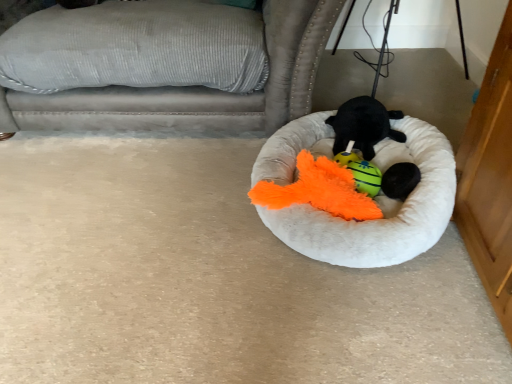
Question: From a real-world perspective, does black fuzzy ball at center stand above gray corduroy couch at upper left?

Choices:
 (A) no
 (B) yes

Answer: (A)

Question: Can you confirm if black fuzzy ball at center is smaller than gray corduroy couch at upper left?

Choices:
 (A) no
 (B) yes

Answer: (B)

Question: Is black fuzzy ball at center not close to gray corduroy couch at upper left?

Choices:
 (A) no
 (B) yes

Answer: (A)

Question: From the image's perspective, is black fuzzy ball at center located above gray corduroy couch at upper left?

Choices:
 (A) yes
 (B) no

Answer: (B)

Question: From the image's perspective, is black fuzzy ball at center located beneath gray corduroy couch at upper left?

Choices:
 (A) yes
 (B) no

Answer: (A)

Question: Considering the relative positions of white fluffy dog bed at center and fluffy orange toy at center, the second toy in the top-to-bottom sequence, in the image provided, is white fluffy dog bed at center to the left or to the right of fluffy orange toy at center, the second toy in the top-to-bottom sequence,?

Choices:
 (A) left
 (B) right

Answer: (A)

Question: From the image's perspective, relative to fluffy orange toy at center, the second toy in the top-to-bottom sequence, is white fluffy dog bed at center above or below?

Choices:
 (A) above
 (B) below

Answer: (A)

Question: From a real-world perspective, is white fluffy dog bed at center above or below fluffy orange toy at center, acting as the first toy starting from the bottom?

Choices:
 (A) above
 (B) below

Answer: (B)

Question: In terms of size, does white fluffy dog bed at center appear bigger or smaller than fluffy orange toy at center, the second toy in the top-to-bottom sequence?

Choices:
 (A) big
 (B) small

Answer: (A)

Question: Looking at the image, does gray corduroy couch at upper left seem bigger or smaller compared to fluffy orange toy at center, the second toy in the top-to-bottom sequence?

Choices:
 (A) big
 (B) small

Answer: (A)

Question: Considering the positions of gray corduroy couch at upper left and fluffy orange toy at center, acting as the first toy starting from the bottom, in the image, is gray corduroy couch at upper left taller or shorter than fluffy orange toy at center, acting as the first toy starting from the bottom,?

Choices:
 (A) short
 (B) tall

Answer: (B)

Question: From the image's perspective, is gray corduroy couch at upper left located above or below fluffy orange toy at center, acting as the first toy starting from the bottom?

Choices:
 (A) above
 (B) below

Answer: (A)

Question: From a real-world perspective, is gray corduroy couch at upper left above or below fluffy orange toy at center, acting as the first toy starting from the bottom?

Choices:
 (A) below
 (B) above

Answer: (B)

Question: From a real-world perspective, is black fuzzy ball at center physically located above or below fluffy orange toy at center, the second toy in the top-to-bottom sequence?

Choices:
 (A) above
 (B) below

Answer: (A)

Question: Based on their positions, is black fuzzy ball at center located to the left or right of fluffy orange toy at center, acting as the first toy starting from the bottom?

Choices:
 (A) right
 (B) left

Answer: (A)